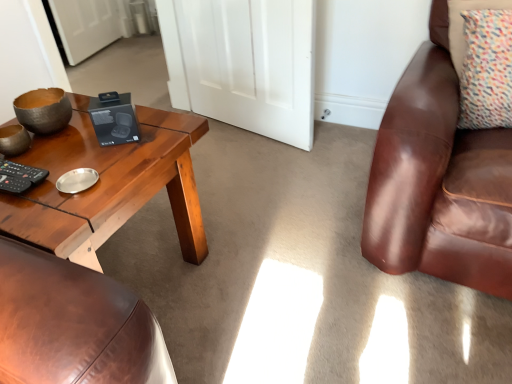
This screenshot has width=512, height=384. I want to click on free spot in front of white matte door at center, so 253,187.